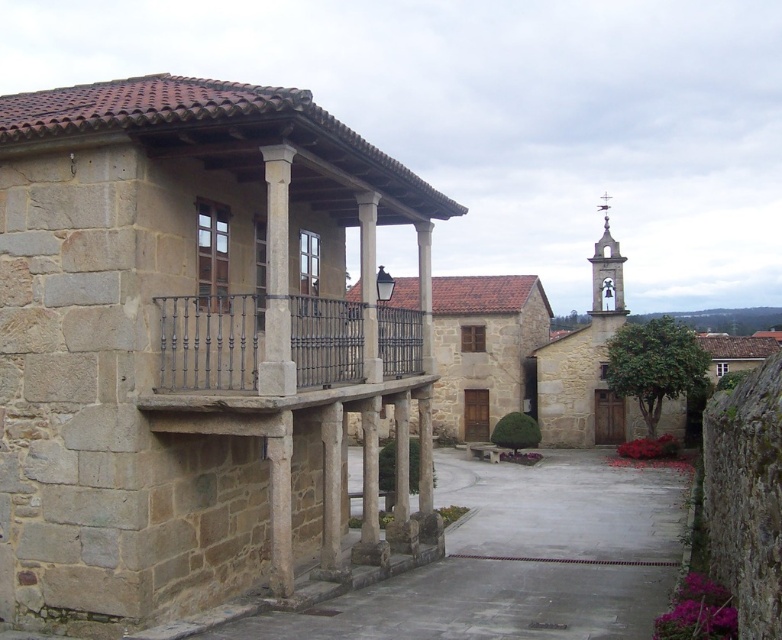
Is black wrought iron balcony at center thinner than smooth stone bell tower at upper right?

Yes.

Does point (357, 307) come behind point (596, 308)?

No, it is not.

You are a GUI agent. You are given a task and a screenshot of the screen. Output one action in this format:
    pyautogui.click(x=<x>, y=<y>)
    Task: Click on the black wrought iron balcony at center
    
    Given the screenshot: What is the action you would take?
    pyautogui.click(x=277, y=342)